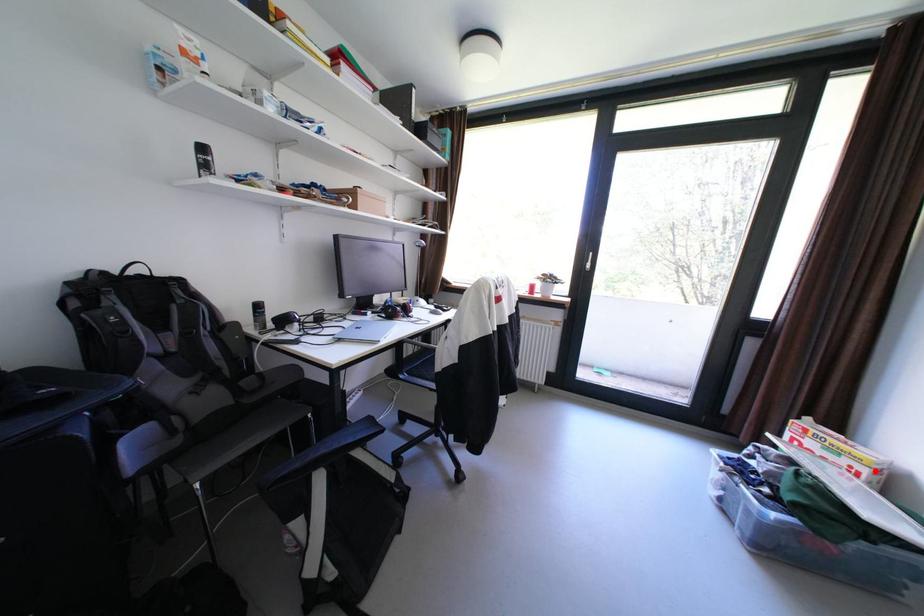
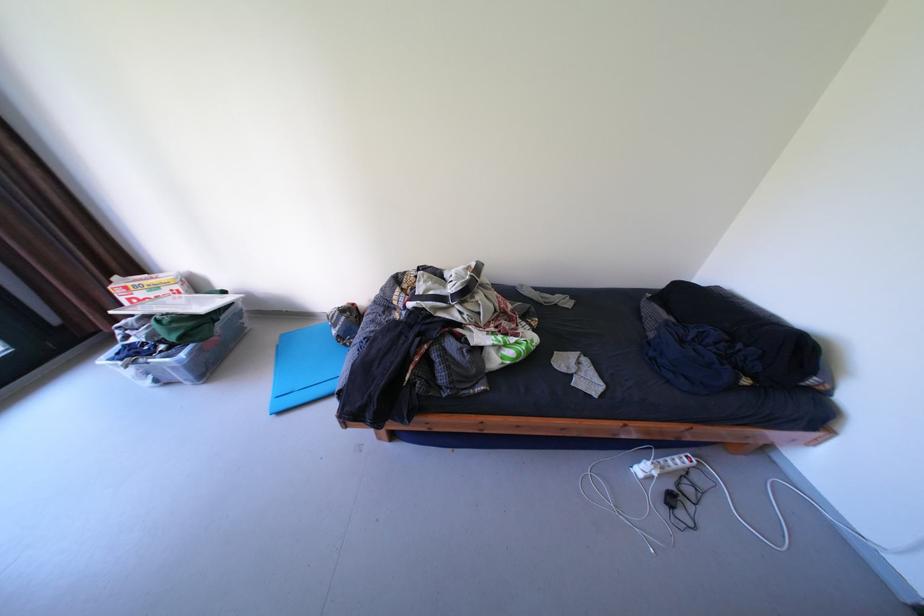
Find the pixel in the second image that matches the highlighted location in the first image.

(188, 286)